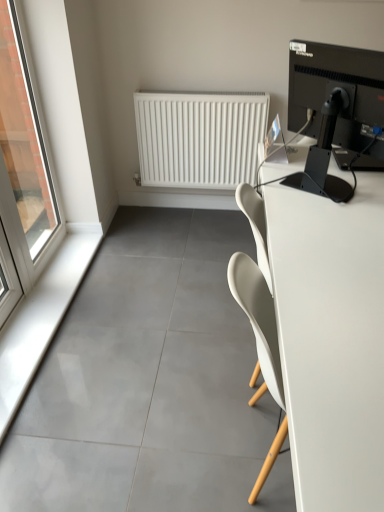
Question: Is white glossy window sill at lower left located outside transparent glass window at left?

Choices:
 (A) no
 (B) yes

Answer: (B)

Question: Does white glossy window sill at lower left turn towards transparent glass window at left?

Choices:
 (A) no
 (B) yes

Answer: (A)

Question: Does white glossy window sill at lower left have a greater width compared to transparent glass window at left?

Choices:
 (A) yes
 (B) no

Answer: (A)

Question: From the image's perspective, would you say white glossy window sill at lower left is shown under transparent glass window at left?

Choices:
 (A) yes
 (B) no

Answer: (A)

Question: Would you say white glossy window sill at lower left is a long distance from transparent glass window at left?

Choices:
 (A) yes
 (B) no

Answer: (B)

Question: From a real-world perspective, is white glossy window sill at lower left located beneath transparent glass window at left?

Choices:
 (A) yes
 (B) no

Answer: (A)

Question: Does white matte radiator at upper center come behind black glossy monitor at upper right?

Choices:
 (A) no
 (B) yes

Answer: (B)

Question: From the image's perspective, does white matte radiator at upper center appear lower than black glossy monitor at upper right?

Choices:
 (A) yes
 (B) no

Answer: (B)

Question: Can you confirm if white matte radiator at upper center is wider than black glossy monitor at upper right?

Choices:
 (A) yes
 (B) no

Answer: (B)

Question: From a real-world perspective, is white matte radiator at upper center physically below black glossy monitor at upper right?

Choices:
 (A) no
 (B) yes

Answer: (B)

Question: Is white matte radiator at upper center at the left side of black glossy monitor at upper right?

Choices:
 (A) no
 (B) yes

Answer: (B)

Question: Is white matte radiator at upper center next to black glossy monitor at upper right?

Choices:
 (A) no
 (B) yes

Answer: (A)

Question: Would you consider black glossy monitor at upper right to be distant from white glossy window sill at lower left?

Choices:
 (A) no
 (B) yes

Answer: (B)